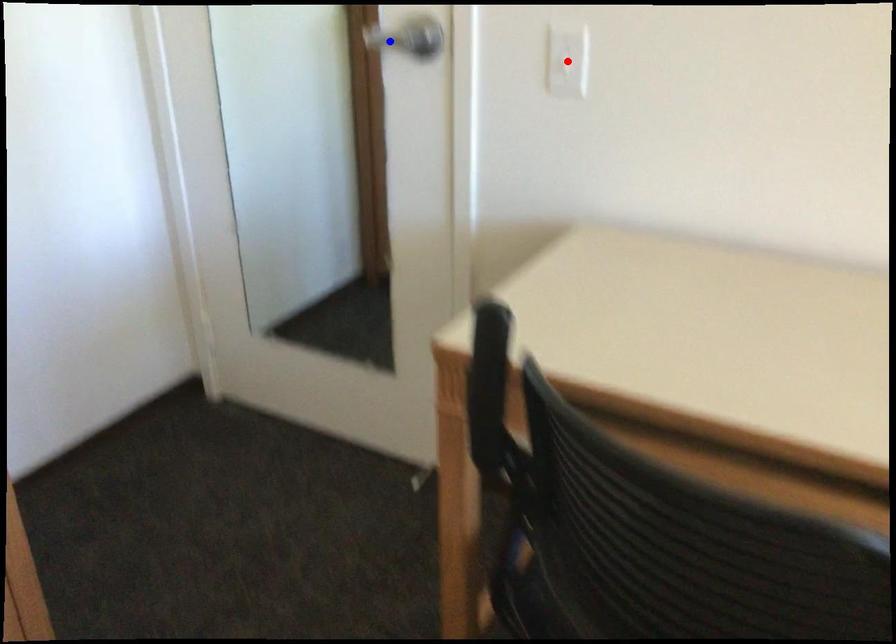
Question: Two points are marked on the image. Which point is closer to the camera?

Choices:
 (A) Blue point is closer.
 (B) Red point is closer.

Answer: (B)